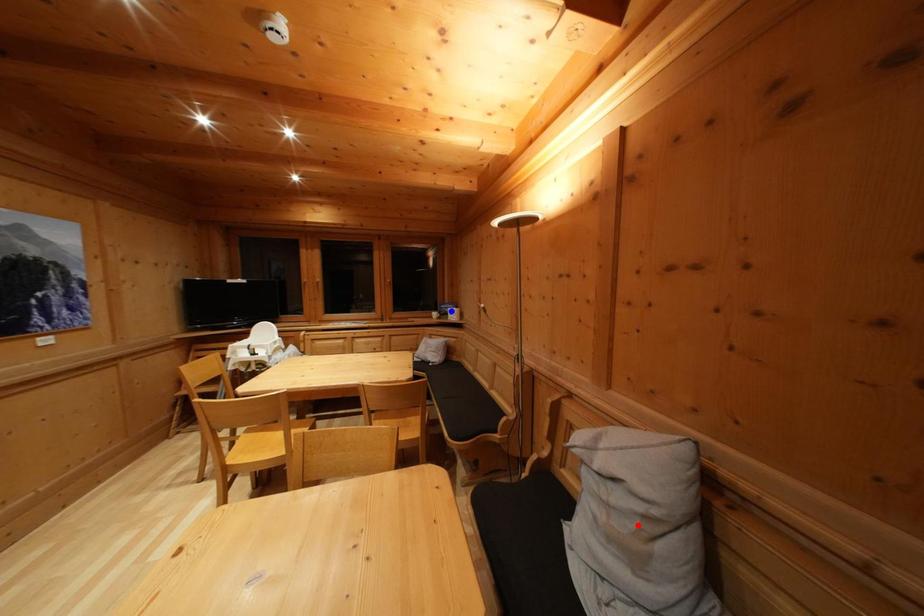
Question: In the image, two points are highlighted. Which point is nearer to the camera? Reply with the corresponding letter.

Choices:
 (A) blue point
 (B) red point

Answer: (B)